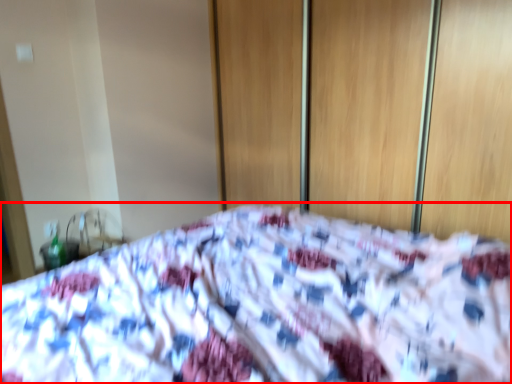
Question: From the image's perspective, where is bed (annotated by the red box) located relative to screen door?

Choices:
 (A) below
 (B) above

Answer: (A)